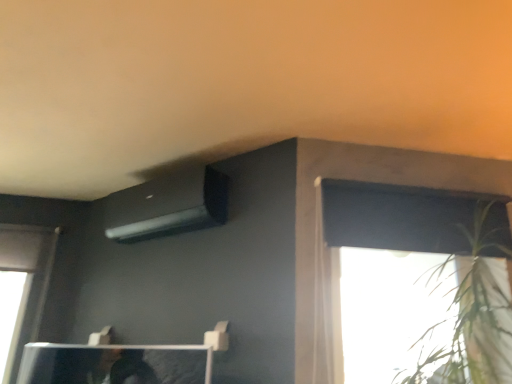
Question: From the image's perspective, is green leafy plant at upper right on top of black matte air conditioner at upper center?

Choices:
 (A) no
 (B) yes

Answer: (A)

Question: Is green leafy plant at upper right to the right of black matte air conditioner at upper center from the viewer's perspective?

Choices:
 (A) yes
 (B) no

Answer: (A)

Question: Are green leafy plant at upper right and black matte air conditioner at upper center located far from each other?

Choices:
 (A) no
 (B) yes

Answer: (B)

Question: From a real-world perspective, is green leafy plant at upper right located higher than black matte air conditioner at upper center?

Choices:
 (A) no
 (B) yes

Answer: (A)

Question: From a real-world perspective, is green leafy plant at upper right physically below black matte air conditioner at upper center?

Choices:
 (A) no
 (B) yes

Answer: (B)

Question: Is point (478, 235) closer or farther from the camera than point (212, 221)?

Choices:
 (A) closer
 (B) farther

Answer: (A)

Question: Considering their positions, is green leafy plant at upper right located in front of or behind black matte air conditioner at upper center?

Choices:
 (A) front
 (B) behind

Answer: (A)

Question: From their relative heights in the image, would you say green leafy plant at upper right is taller or shorter than black matte air conditioner at upper center?

Choices:
 (A) tall
 (B) short

Answer: (A)

Question: Choose the correct answer: Is green leafy plant at upper right inside black matte air conditioner at upper center or outside it?

Choices:
 (A) outside
 (B) inside

Answer: (A)

Question: Considering the positions of white sheer curtain at upper right and black matte air conditioner at upper center in the image, is white sheer curtain at upper right wider or thinner than black matte air conditioner at upper center?

Choices:
 (A) thin
 (B) wide

Answer: (A)

Question: From a real-world perspective, is white sheer curtain at upper right physically located above or below black matte air conditioner at upper center?

Choices:
 (A) below
 (B) above

Answer: (A)

Question: Relative to black matte air conditioner at upper center, is white sheer curtain at upper right in front or behind?

Choices:
 (A) front
 (B) behind

Answer: (A)

Question: Which is correct: white sheer curtain at upper right is inside black matte air conditioner at upper center, or outside of it?

Choices:
 (A) inside
 (B) outside

Answer: (B)

Question: From a real-world perspective, is black matte air conditioner at upper center positioned above or below green leafy plant at upper right?

Choices:
 (A) above
 (B) below

Answer: (A)

Question: Considering the positions of black matte air conditioner at upper center and green leafy plant at upper right in the image, is black matte air conditioner at upper center bigger or smaller than green leafy plant at upper right?

Choices:
 (A) big
 (B) small

Answer: (B)